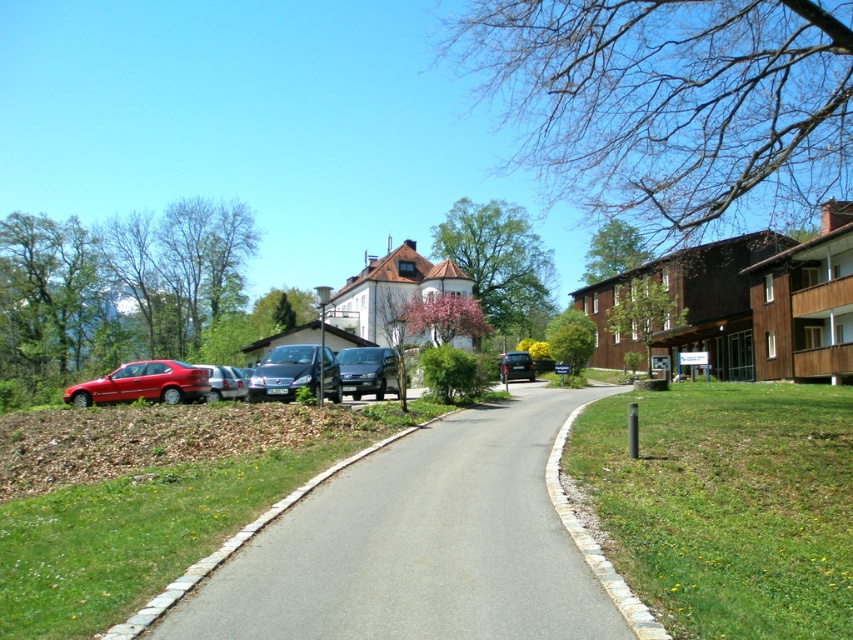
Question: Is shiny silver van at center-left above metallic silver sedan at left?

Choices:
 (A) no
 (B) yes

Answer: (B)

Question: Which of the following is the closest to the observer?

Choices:
 (A) pos(238,385)
 (B) pos(511,376)
 (C) pos(317,353)

Answer: (C)

Question: Which object appears closest to the camera in this image?

Choices:
 (A) asphalt at center
 (B) shiny silver van at center-left

Answer: (A)

Question: Does asphalt at center have a lesser width compared to shiny red sedan at left?

Choices:
 (A) yes
 (B) no

Answer: (A)

Question: Which of the following is the closest to the observer?

Choices:
 (A) matte black van at center
 (B) metallic silver sedan at center
 (C) metallic silver sedan at left
 (D) shiny red sedan at left

Answer: (A)

Question: Is shiny red sedan at left wider than metallic silver sedan at center?

Choices:
 (A) yes
 (B) no

Answer: (A)